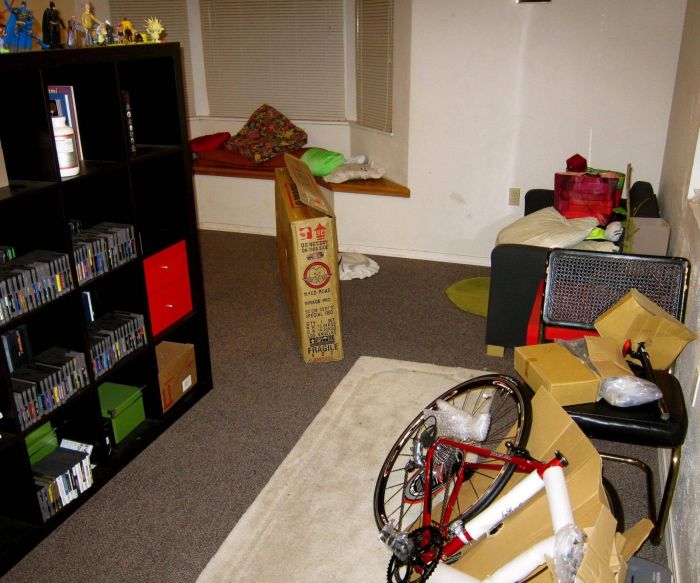
I want to click on action figures, so click(x=19, y=43), click(x=50, y=28), click(x=77, y=45), click(x=90, y=26), click(x=108, y=31), click(x=119, y=37), click(x=127, y=30), click(x=138, y=30), click(x=154, y=34).